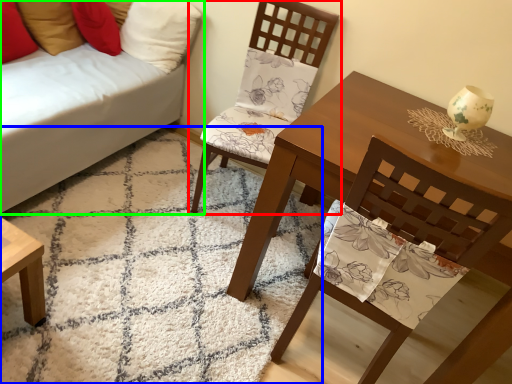
Question: Considering the real-world distances, which object is farthest from chair (highlighted by a red box)? mat (highlighted by a blue box) or studio couch (highlighted by a green box)?

Choices:
 (A) mat
 (B) studio couch

Answer: (A)